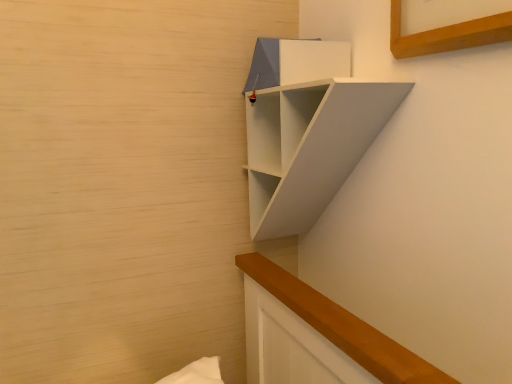
What do you see at coordinates (309, 147) in the screenshot?
I see `white matte shelf at upper right` at bounding box center [309, 147].

What is the approximate width of white matte shelf at upper right?

white matte shelf at upper right is 5.98 inches wide.

Locate an element on the screen. white matte shelf at upper right is located at coordinates (x=309, y=147).

What do you see at coordinates (296, 62) in the screenshot? This screenshot has width=512, height=384. I see `matte white cabinet at upper center` at bounding box center [296, 62].

The width and height of the screenshot is (512, 384). In order to click on matte white cabinet at upper center in this screenshot , I will do `click(296, 62)`.

Measure the distance between matte white cabinet at upper center and camera.

A distance of 28.15 inches exists between matte white cabinet at upper center and camera.

Where is `white matte shelf at upper right`? The height and width of the screenshot is (384, 512). white matte shelf at upper right is located at coordinates (309, 147).

In the image, is white matte shelf at upper right on the left side or the right side of matte white cabinet at upper center?

white matte shelf at upper right is positioned on matte white cabinet at upper center's right side.

In the image, is white matte shelf at upper right positioned in front of or behind matte white cabinet at upper center?

Visually, white matte shelf at upper right is located in front of matte white cabinet at upper center.

Between point (290, 227) and point (337, 58), which one is positioned behind?

Point (290, 227)

From the image's perspective, which is below, white matte shelf at upper right or matte white cabinet at upper center?

From the image's view, white matte shelf at upper right is below.

In the scene shown: From a real-world perspective, which is physically below, white matte shelf at upper right or matte white cabinet at upper center?

In real-world perspective, white matte shelf at upper right is lower.

In terms of width, does white matte shelf at upper right look wider or thinner when compared to matte white cabinet at upper center?

white matte shelf at upper right is wider than matte white cabinet at upper center.

Who is taller, white matte shelf at upper right or matte white cabinet at upper center?

With more height is white matte shelf at upper right.

Is white matte shelf at upper right smaller than matte white cabinet at upper center?

No, white matte shelf at upper right is not smaller than matte white cabinet at upper center.

Is white matte shelf at upper right situated inside matte white cabinet at upper center or outside?

white matte shelf at upper right exists outside the volume of matte white cabinet at upper center.

In the scene shown: Is white matte shelf at upper right next to matte white cabinet at upper center and touching it?

No, white matte shelf at upper right is not touching matte white cabinet at upper center.

Is white matte shelf at upper right facing away from matte white cabinet at upper center?

Correct, white matte shelf at upper right is looking away from matte white cabinet at upper center.

Can you tell me how much white matte shelf at upper right and matte white cabinet at upper center differ in facing direction?

The facing directions of white matte shelf at upper right and matte white cabinet at upper center are 2.6 degrees apart.

Find the location of a particular element. cabinet located on the left of white matte shelf at upper right is located at coordinates (296, 62).

Considering the relative positions of matte white cabinet at upper center and white matte shelf at upper right in the image provided, is matte white cabinet at upper center to the left or to the right of white matte shelf at upper right?

Clearly, matte white cabinet at upper center is on the left of white matte shelf at upper right in the image.

Is matte white cabinet at upper center further to the viewer compared to white matte shelf at upper right?

Yes, matte white cabinet at upper center is further from the camera.

Does point (277, 79) come in front of point (269, 136)?

Yes, point (277, 79) is closer to viewer.

From the image's perspective, which one is positioned lower, matte white cabinet at upper center or white matte shelf at upper right?

white matte shelf at upper right, from the image's perspective.

From a real-world perspective, which object stands above the other?

matte white cabinet at upper center, from a real-world perspective.

Considering the sizes of objects matte white cabinet at upper center and white matte shelf at upper right in the image provided, who is wider, matte white cabinet at upper center or white matte shelf at upper right?

With larger width is white matte shelf at upper right.

Which of these two, matte white cabinet at upper center or white matte shelf at upper right, stands shorter?

matte white cabinet at upper center is shorter.

Between matte white cabinet at upper center and white matte shelf at upper right, which one has smaller size?

Smaller between the two is matte white cabinet at upper center.

Can we say matte white cabinet at upper center lies outside white matte shelf at upper right?

That's incorrect, matte white cabinet at upper center is not completely outside white matte shelf at upper right.

Is matte white cabinet at upper center next to white matte shelf at upper right?

No, matte white cabinet at upper center is not with white matte shelf at upper right.

In the scene shown: Is matte white cabinet at upper center facing away from white matte shelf at upper right?

Yes, matte white cabinet at upper center is positioned with its back facing white matte shelf at upper right.

Where is `cabinet located behind the white matte shelf at upper right`? The width and height of the screenshot is (512, 384). cabinet located behind the white matte shelf at upper right is located at coordinates (296, 62).

In order to click on cabinet above the white matte shelf at upper right (from a real-world perspective) in this screenshot , I will do `click(296, 62)`.

This screenshot has height=384, width=512. What are the coordinates of `cabinet that is above the white matte shelf at upper right (from the image's perspective)` in the screenshot? It's located at (296, 62).